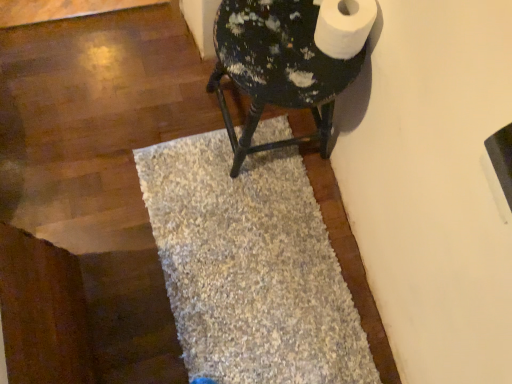
Question: Would you say white matte toilet paper at upper right is to the left or to the right of painted wood stool at upper right in the picture?

Choices:
 (A) right
 (B) left

Answer: (A)

Question: In terms of height, does white matte toilet paper at upper right look taller or shorter compared to painted wood stool at upper right?

Choices:
 (A) short
 (B) tall

Answer: (A)

Question: Based on their relative distances, which object is nearer to the white matte toilet paper at upper right?

Choices:
 (A) painted wood stool at upper right
 (B) beige shaggy bath mat at center

Answer: (A)

Question: Based on their relative distances, which object is nearer to the painted wood stool at upper right?

Choices:
 (A) beige shaggy bath mat at center
 (B) white matte toilet paper at upper right

Answer: (B)